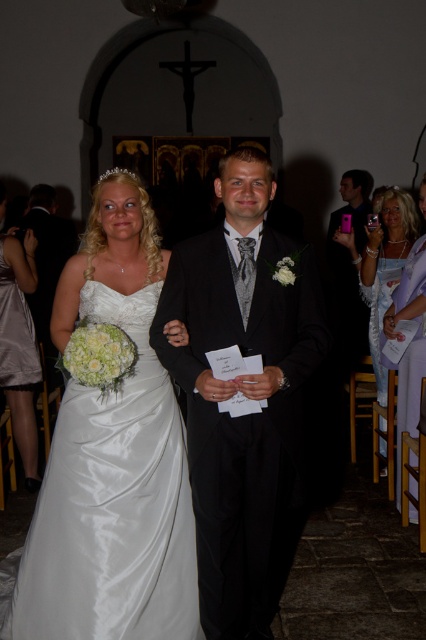
Question: Which object is the farthest from the satin dress at center?

Choices:
 (A) black satin suit at center
 (B) matte purple dress at lower right
 (C) matte black suit at right
 (D) pearl necklace at upper right

Answer: (C)

Question: Does satin dress at center appear on the left side of white satin dress at center?

Choices:
 (A) yes
 (B) no

Answer: (B)

Question: Is satin white dress at center above matte purple dress at lower right?

Choices:
 (A) no
 (B) yes

Answer: (A)

Question: Which object is closer to the camera taking this photo?

Choices:
 (A) matte purple dress at lower right
 (B) black satin suit at center
 (C) white satin dress at right

Answer: (B)

Question: Which point is farther to the camera?

Choices:
 (A) pearl necklace at upper right
 (B) white satin dress at center
 (C) black satin suit at center
 (D) satin white dress at center

Answer: (B)

Question: Does satin dress at center have a larger size compared to white satin dress at center?

Choices:
 (A) yes
 (B) no

Answer: (A)